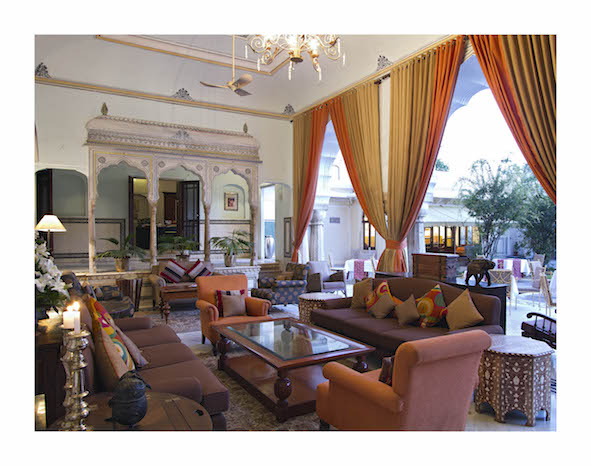
I want to click on candle flames, so click(68, 307), click(76, 304).